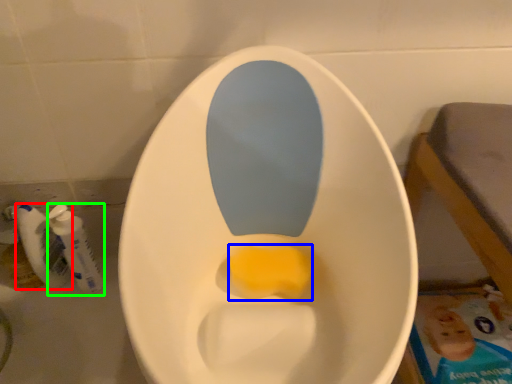
Question: Considering the real-world distances, which object is closest to mouthwash (highlighted by a red box)? food (highlighted by a blue box) or mouthwash (highlighted by a green box).

Choices:
 (A) food
 (B) mouthwash

Answer: (B)